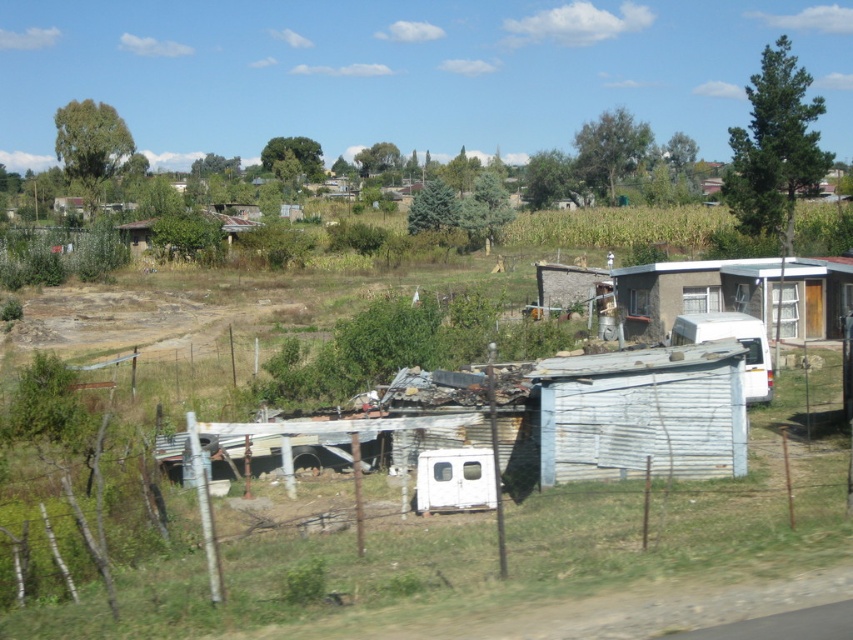
You are a farmer who needs to move a heavy equipment from the white corrugated metal hut at right to the rusty corrugated hut at center. Given that the path between them is narrow, can you move it directly without detour?

The white corrugated metal hut at right is positioned on the right side of the rusty corrugated hut at center, so the path between them is narrow. Since the equipment is heavy, it might be difficult to maneuver directly without causing damage or obstruction. A detour would be safer and more practical.